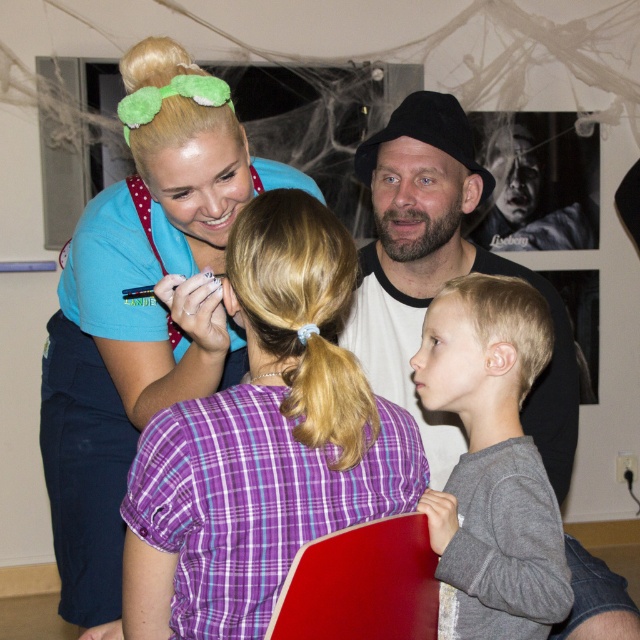
Based on the photo, please provide the 2D coordinates of the purple plaid shirt at center in the image coordinate system where the origin is at the bottom left corner of the image. The coordinates should be in the format of a tuple with two decimal numbers separated by a comma, like this example format. The first number is the x coordinate, the second number is the y coordinate. The coordinate system has x increasing to the right and y increasing upwards. The maximum x and y values are both 1.0.

The 2D coordinates of the purple plaid shirt at center are at point (262, 440).

You are a costume designer preparing for a Halloween party. You have two items to place in the scene described. The gray cotton shirt at right and the black cotton hat at upper center. Which item is smaller in size?

The gray cotton shirt at right is smaller in size compared to the black cotton hat at upper center.

You are standing in the room and want to hand a decoration to someone. If you extend your arm forward, which object between the purple plaid shirt at center and the black cotton hat at upper center can you reach without moving your arm?

The purple plaid shirt at center is closer to the viewer than the black cotton hat at upper center, so you can reach the purple plaid shirt at center without moving your arm.